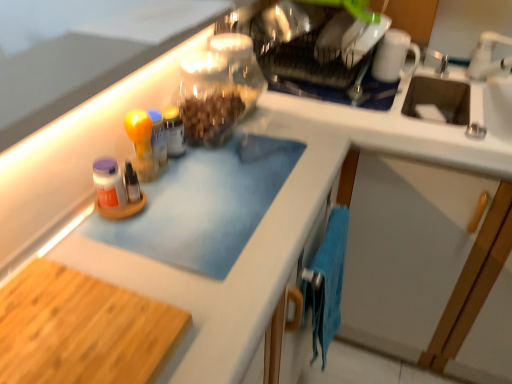
In order to face translucent glass jar at center, should I rotate leftwards or rightwards?

To face it directly, rotate left by 10.704 degrees.

This screenshot has height=384, width=512. I want to click on white ceramic faucet at upper right, so [488, 57].

The width and height of the screenshot is (512, 384). Find the location of `white glossy mug at upper right`. white glossy mug at upper right is located at coordinates (393, 56).

You are a GUI agent. You are given a task and a screenshot of the screen. Output one action in this format:
    pyautogui.click(x=<x>, y=<y>)
    Task: Click on the blue matte cutting board at upper left
    The image size is (512, 384).
    Given the screenshot: What is the action you would take?
    pyautogui.click(x=83, y=51)

From a real-world perspective, who is located lower, wooden cutting board at lower left or transparent glass jar at upper center?

In real-world perspective, wooden cutting board at lower left is lower.

Are wooden cutting board at lower left and transparent glass jar at upper center far apart?

No, wooden cutting board at lower left is not far from transparent glass jar at upper center.

Is the depth of wooden cutting board at lower left less than that of transparent glass jar at upper center?

Yes, it is.

How many degrees apart are the facing directions of wooden cutting board at lower left and transparent glass jar at upper center?

There is a 0.000133-degree angle between the facing directions of wooden cutting board at lower left and transparent glass jar at upper center.

Identify the location of faucet lying on the right of clear glass jar at upper center. The height and width of the screenshot is (384, 512). (488, 57).

In the image, is clear glass jar at upper center positioned in front of or behind white ceramic faucet at upper right?

Clearly, clear glass jar at upper center is behind white ceramic faucet at upper right.

In the scene shown: From the image's perspective, is clear glass jar at upper center above white ceramic faucet at upper right?

Yes, from the image's perspective, clear glass jar at upper center is above white ceramic faucet at upper right.

Is clear glass jar at upper center shorter than white ceramic faucet at upper right?

Yes, clear glass jar at upper center is shorter than white ceramic faucet at upper right.

Is transparent glass jar at upper center located outside blue microfiber towel at lower right?

Yes, transparent glass jar at upper center is outside of blue microfiber towel at lower right.

Is transparent glass jar at upper center positioned with its back to blue microfiber towel at lower right?

transparent glass jar at upper center is not turned away from blue microfiber towel at lower right.

From a real-world perspective, who is located higher, transparent glass jar at upper center or blue microfiber towel at lower right?

In real-world perspective, transparent glass jar at upper center is above.

Considering the positions of points (239, 87) and (335, 330), is point (239, 87) closer to camera compared to point (335, 330)?

That is True.

Who is taller, white glossy mug at upper right or white ceramic faucet at upper right?

white ceramic faucet at upper right.

Does white glossy mug at upper right come in front of white ceramic faucet at upper right?

That is False.

Considering the points (401, 73) and (484, 54), which point is behind, point (401, 73) or point (484, 54)?

The point (484, 54) is farther from the camera.

What's the angular difference between white glossy mug at upper right and white ceramic faucet at upper right's facing directions?

The facing directions of white glossy mug at upper right and white ceramic faucet at upper right are 54.5 degrees apart.

Who is smaller, transparent glass jar at upper center or blue matte cutting board at upper left?

With smaller size is transparent glass jar at upper center.

In the scene shown: Which is more to the left, transparent glass jar at upper center or blue matte cutting board at upper left?

blue matte cutting board at upper left.

From the image's perspective, is transparent glass jar at upper center located beneath blue matte cutting board at upper left?

Indeed, from the image's perspective, transparent glass jar at upper center is shown beneath blue matte cutting board at upper left.

Would you say transparent glass jar at upper center is a long distance from blue matte cutting board at upper left?

No, transparent glass jar at upper center is not far away from blue matte cutting board at upper left.

Would you say blue microfiber towel at lower right is inside or outside clear glass jar at upper center?

blue microfiber towel at lower right is outside clear glass jar at upper center.

Which object is wider, blue microfiber towel at lower right or clear glass jar at upper center?

With larger width is clear glass jar at upper center.

Considering the sizes of objects blue microfiber towel at lower right and clear glass jar at upper center in the image provided, who is shorter, blue microfiber towel at lower right or clear glass jar at upper center?

clear glass jar at upper center.

In the scene shown: In the image, is blue microfiber towel at lower right on the left side or the right side of clear glass jar at upper center?

From the image, it's evident that blue microfiber towel at lower right is to the left of clear glass jar at upper center.

The image size is (512, 384). In order to click on countertop above the transparent glass jar at upper center (from a real-world perspective) in this screenshot , I will do `click(83, 51)`.

In terms of size, does blue matte cutting board at upper left appear bigger or smaller than transparent glass jar at upper center?

Considering their sizes, blue matte cutting board at upper left takes up more space than transparent glass jar at upper center.

Looking at their sizes, would you say blue matte cutting board at upper left is wider or thinner than transparent glass jar at upper center?

Considering their sizes, blue matte cutting board at upper left looks broader than transparent glass jar at upper center.

Choose the correct answer: Is blue matte cutting board at upper left inside transparent glass jar at upper center or outside it?

blue matte cutting board at upper left is not enclosed by transparent glass jar at upper center.

Locate an element on the screen. The width and height of the screenshot is (512, 384). cutting board in front of the transparent glass jar at upper center is located at coordinates (82, 329).

Where is `faucet to the right of clear glass jar at upper center`? faucet to the right of clear glass jar at upper center is located at coordinates (488, 57).

Based on their spatial positions, is transparent glass jar at upper center or white ceramic faucet at upper right closer to clear glass jar at upper center?

Based on the image, transparent glass jar at upper center appears to be nearer to clear glass jar at upper center.

Which object lies nearer to the anchor point white glossy mug at upper right, clear glass jar at upper center or translucent glass jar at center?

clear glass jar at upper center is closer to white glossy mug at upper right.

When comparing their distances from wooden cutting board at lower left, does white glossy mug at upper right or white ceramic faucet at upper right seem further?

Among the two, white ceramic faucet at upper right is located further to wooden cutting board at lower left.

Based on their spatial positions, is translucent glass jar at center or transparent glass jar at upper center closer to white glossy mug at upper right?

transparent glass jar at upper center lies closer to white glossy mug at upper right than the other object.

Looking at the image, which one is located closer to blue microfiber towel at lower right, wooden cutting board at lower left or white glossy mug at upper right?

Based on the image, wooden cutting board at lower left appears to be nearer to blue microfiber towel at lower right.

Considering their positions, is white glossy mug at upper right positioned closer to translucent glass jar at center than white ceramic faucet at upper right?

Based on the image, white glossy mug at upper right appears to be nearer to translucent glass jar at center.

Which object lies nearer to the anchor point white glossy mug at upper right, blue microfiber towel at lower right or clear glass jar at upper center?

Among the two, clear glass jar at upper center is located nearer to white glossy mug at upper right.

In the scene shown: When comparing their distances from wooden cutting board at lower left, does blue matte cutting board at upper left or translucent glass jar at center seem further?

Based on the image, translucent glass jar at center appears to be further to wooden cutting board at lower left.

Where is `appliance between wooden cutting board at lower left and white ceramic faucet at upper right in the horizontal direction`? This screenshot has width=512, height=384. appliance between wooden cutting board at lower left and white ceramic faucet at upper right in the horizontal direction is located at coordinates (305, 53).

The width and height of the screenshot is (512, 384). Find the location of `mug located between wooden cutting board at lower left and white ceramic faucet at upper right in the left-right direction`. mug located between wooden cutting board at lower left and white ceramic faucet at upper right in the left-right direction is located at coordinates (393, 56).

Where is `countertop between white glossy mug at upper right and blue microfiber towel at lower right in the vertical direction`? This screenshot has height=384, width=512. countertop between white glossy mug at upper right and blue microfiber towel at lower right in the vertical direction is located at coordinates (83, 51).

You are a GUI agent. You are given a task and a screenshot of the screen. Output one action in this format:
    pyautogui.click(x=<x>, y=<y>)
    Task: Click on the hand towel located between wooden cutting board at lower left and white glossy mug at upper right in the depth direction
    Image resolution: width=512 pixels, height=384 pixels.
    Given the screenshot: What is the action you would take?
    pyautogui.click(x=327, y=282)